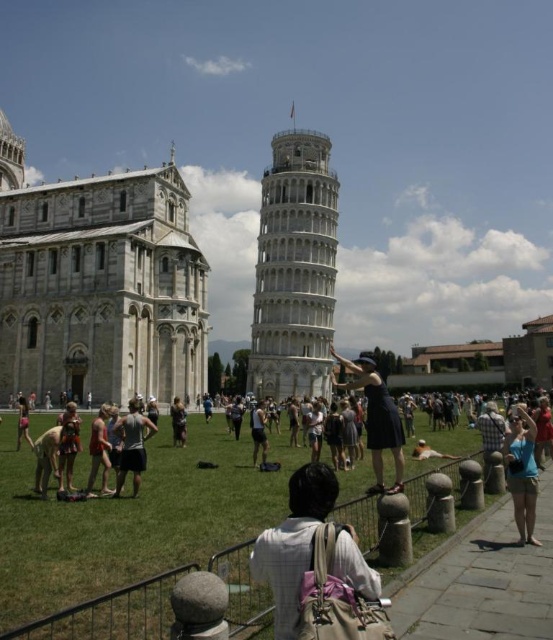
You are standing in the Piazza dei Miracoli in Pisa, Italy, and you see the white marble tower at center. If you want to take a photo of the tower from exactly 100 meters away, would you need to move closer or farther away from the tower?

The white marble tower at center is currently 109.49 meters away from the camera. To take a photo from exactly 100 meters away, you would need to move closer to the tower by 9.49 meters.

You are a tourist visiting Piazza dei Miracoli and want to take a photo that includes both the white marble cathedral at upper left and the blue denim shorts at lower right. Which object should you frame first in your camera viewfinder to ensure both are in the shot?

You should frame the white marble cathedral at upper left first because its width is larger than the blue denim shorts at lower right, so centering on the wider object first will help include both in the frame.

You are a tourist standing in the Piazza dei Miracoli and want to take a photo that includes both the white marble cathedral at upper left and the blue denim shorts at lower right. Which object should you point your camera towards first to ensure both are in the frame?

The white marble cathedral at upper left is positioned over the blue denim shorts at lower right, so you should point your camera towards the white marble cathedral at upper left first to ensure both are in the frame.